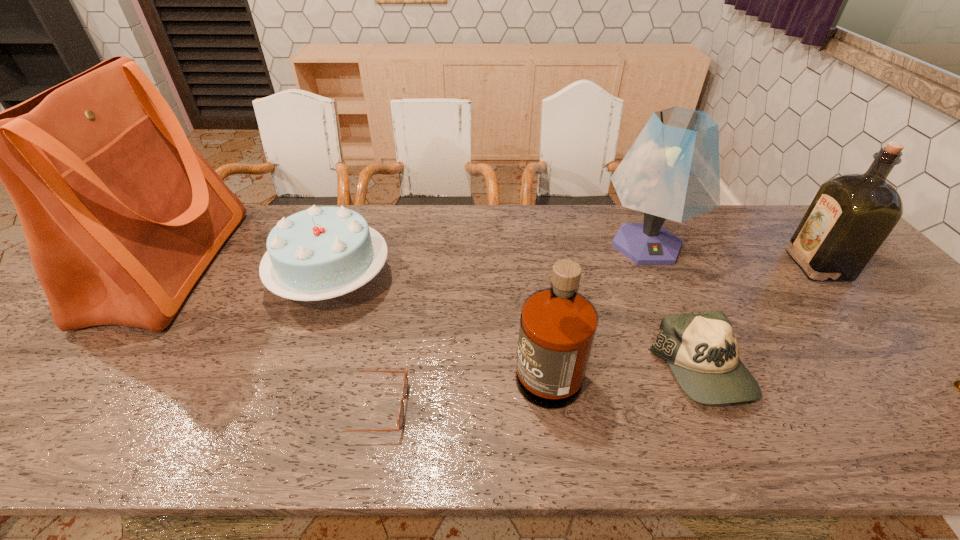
At what (x,y) coordinates should I click in order to perform the action: click on the leftmost object. Please return your answer as a coordinate pair (x, y). Looking at the image, I should click on (121, 213).

Identify the location of the tallest object. The image size is (960, 540). (121, 213).

The image size is (960, 540). Find the location of `lampshade`. lampshade is located at coordinates (671, 171).

You are a GUI agent. You are given a task and a screenshot of the screen. Output one action in this format:
    pyautogui.click(x=<x>, y=<y>)
    Task: Click on the farther liquor
    
    Given the screenshot: What is the action you would take?
    pos(850,217)

Find the location of a particular element. Image resolution: width=960 pixels, height=540 pixels. the left liquor is located at coordinates (558, 325).

At what (x,y) coordinates should I click in order to perform the action: click on the fifth object from right to left. Please return your answer as a coordinate pair (x, y). The image size is (960, 540). Looking at the image, I should click on (558, 325).

Find the location of `the fifth tallest object`. the fifth tallest object is located at coordinates (320, 253).

Find the location of `baseball cap`. baseball cap is located at coordinates (700, 348).

The image size is (960, 540). In order to click on sunglasses in this screenshot , I will do `click(400, 419)`.

What are the coordinates of `vacant space located on the front pocket of the shopping bag` in the screenshot? It's located at (285, 266).